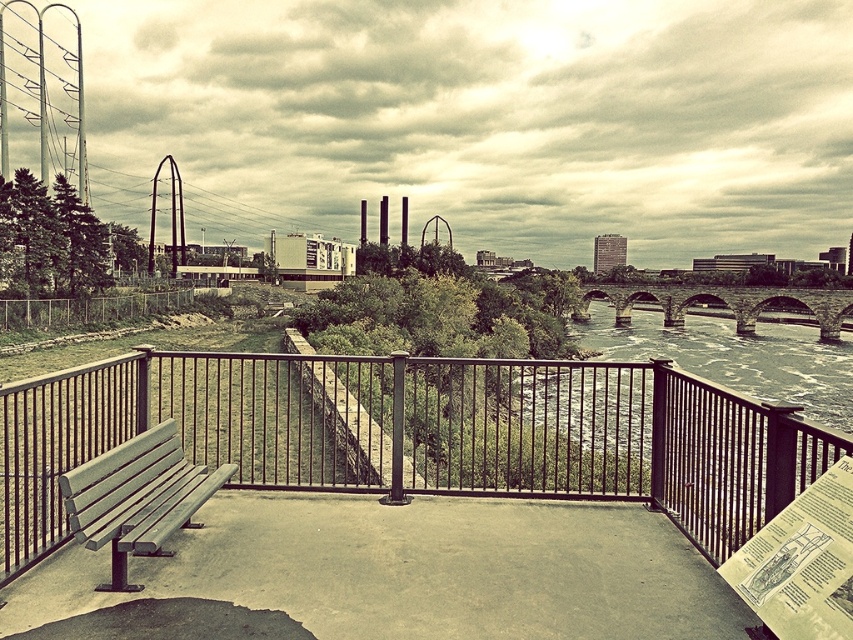
You are standing on the platform and want to take a photo of the metal at left and the stone arch bridge at right. Which object should you position closer to the bottom of your camera frame?

The metal at left should be positioned closer to the bottom of the camera frame since it is located below the stone arch bridge at right.